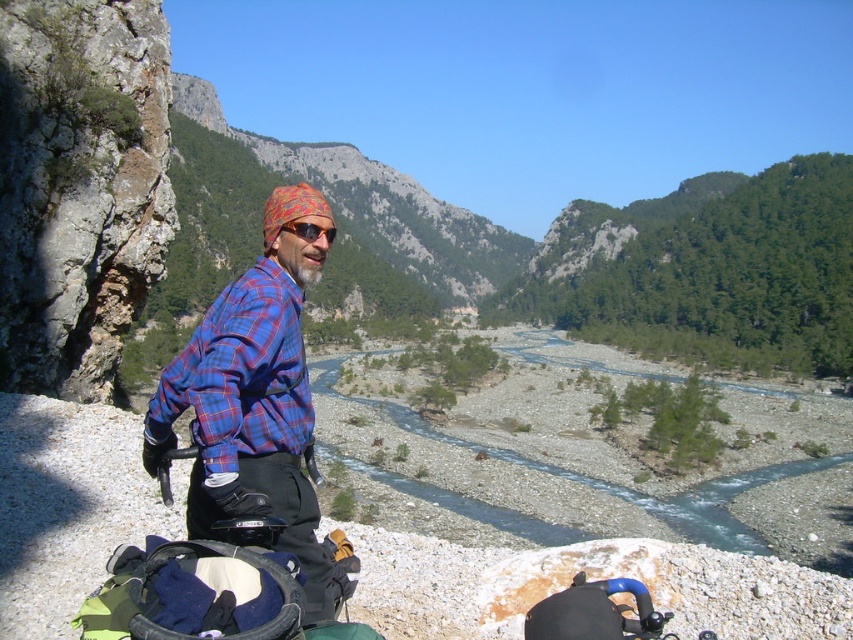
Question: Based on their relative distances, which object is nearer to the blue plaid shirt at center?

Choices:
 (A) blue plaid shirt at left
 (B) matte orange goggles at center

Answer: (A)

Question: Is blue plaid shirt at center bigger than blue plaid shirt at left?

Choices:
 (A) no
 (B) yes

Answer: (B)

Question: Does blue plaid shirt at center come in front of blue plaid shirt at left?

Choices:
 (A) no
 (B) yes

Answer: (B)

Question: Does blue plaid shirt at left appear over matte orange goggles at center?

Choices:
 (A) no
 (B) yes

Answer: (A)

Question: Estimate the real-world distances between objects in this image. Which object is closer to the blue plaid shirt at left?

Choices:
 (A) blue plaid shirt at center
 (B) matte orange goggles at center

Answer: (B)

Question: Which object appears closest to the camera in this image?

Choices:
 (A) blue plaid shirt at center
 (B) matte orange goggles at center
 (C) blue plaid shirt at left

Answer: (A)